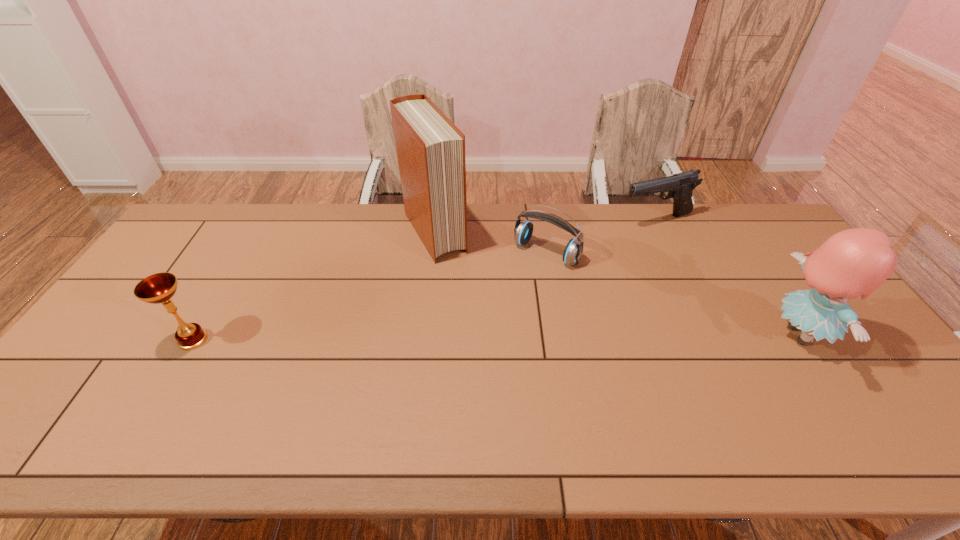
Identify which object is located as the third nearest to the headset. Please provide its 2D coordinates. Your answer should be formatted as a tuple, i.e. [(x, y)], where the tuple contains the x and y coordinates of a point satisfying the conditions above.

[(855, 262)]